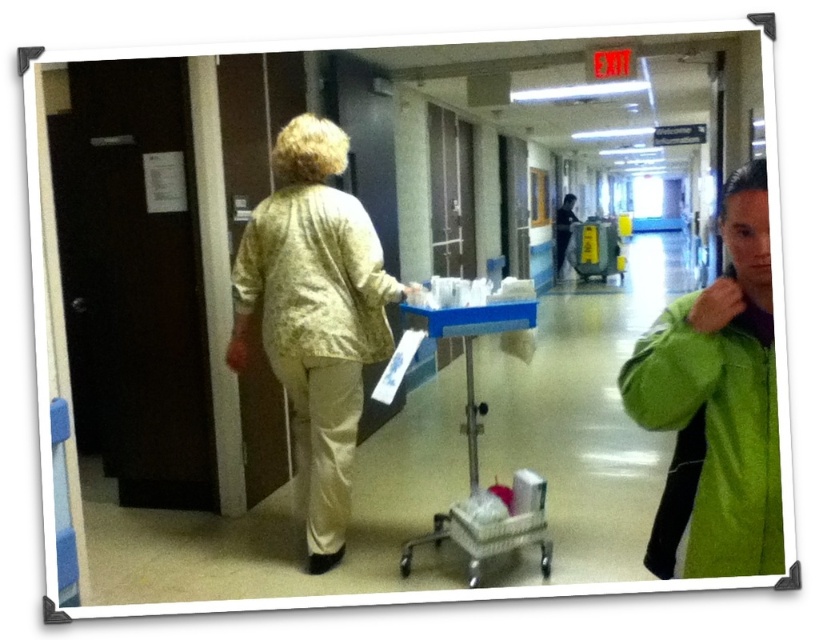
Is point (269, 257) closer to viewer compared to point (541, 561)?

Yes.

Is fluffy beige jacket at center closer to the viewer compared to metallic blue trolley at center?

No, fluffy beige jacket at center is further to the viewer.

Image resolution: width=819 pixels, height=640 pixels. What do you see at coordinates (315, 276) in the screenshot?
I see `fluffy beige jacket at center` at bounding box center [315, 276].

Identify the location of fluffy beige jacket at center. The height and width of the screenshot is (640, 819). (315, 276).

From the picture: Who is lower down, floral fabric jacket at center or green fleece jacket at right?

green fleece jacket at right

Can you confirm if floral fabric jacket at center is bigger than green fleece jacket at right?

Correct, floral fabric jacket at center is larger in size than green fleece jacket at right.

Which is behind, point (364, 292) or point (667, 573)?

The point (364, 292) is more distant.

Image resolution: width=819 pixels, height=640 pixels. In order to click on floral fabric jacket at center in this screenshot , I will do `click(315, 316)`.

Can you confirm if green fleece jacket at right is positioned above fluffy beige jacket at center?

Actually, green fleece jacket at right is below fluffy beige jacket at center.

Does green fleece jacket at right appear on the right side of fluffy beige jacket at center?

Correct, you'll find green fleece jacket at right to the right of fluffy beige jacket at center.

Does point (731, 353) come in front of point (270, 276)?

Yes.

At what (x,y) coordinates should I click in order to perform the action: click on green fleece jacket at right. Please return your answer as a coordinate pair (x, y). The image size is (819, 640). Looking at the image, I should click on (711, 440).